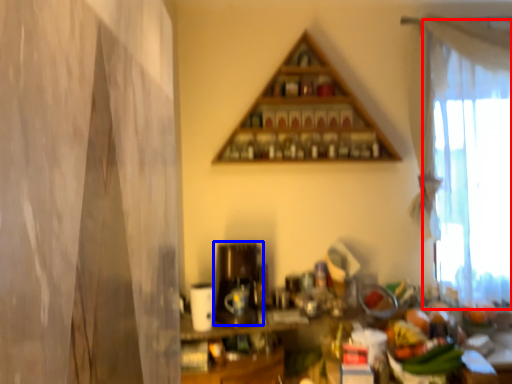
Question: Which object is further to the camera taking this photo, curtain (highlighted by a red box) or appliance (highlighted by a blue box)?

Choices:
 (A) curtain
 (B) appliance

Answer: (A)